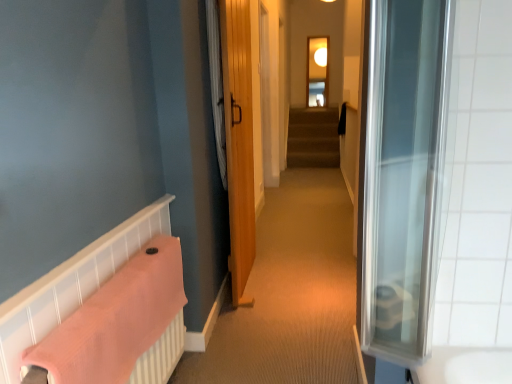
Question: Is pink fabric towel at lower left wider than transparent glass window at upper center?

Choices:
 (A) no
 (B) yes

Answer: (B)

Question: From a real-world perspective, is pink fabric towel at lower left beneath transparent glass window at upper center?

Choices:
 (A) yes
 (B) no

Answer: (A)

Question: Would you consider pink fabric towel at lower left to be distant from transparent glass window at upper center?

Choices:
 (A) yes
 (B) no

Answer: (A)

Question: From the image's perspective, is pink fabric towel at lower left located above transparent glass window at upper center?

Choices:
 (A) yes
 (B) no

Answer: (B)

Question: Is pink fabric towel at lower left placed right next to transparent glass window at upper center?

Choices:
 (A) no
 (B) yes

Answer: (A)

Question: Considering their positions, is pink fabric towel at lower left located in front of or behind transparent glass window at upper center?

Choices:
 (A) behind
 (B) front

Answer: (B)

Question: Based on their positions, is pink fabric towel at lower left located to the left or right of transparent glass window at upper center?

Choices:
 (A) left
 (B) right

Answer: (A)

Question: From a real-world perspective, is pink fabric towel at lower left physically located above or below transparent glass window at upper center?

Choices:
 (A) below
 (B) above

Answer: (A)

Question: Choose the correct answer: Is pink fabric towel at lower left inside transparent glass window at upper center or outside it?

Choices:
 (A) inside
 (B) outside

Answer: (B)

Question: From a real-world perspective, is wooden door at center physically located above or below white fabric shower curtain at center?

Choices:
 (A) above
 (B) below

Answer: (B)

Question: From the image's perspective, is wooden door at center located above or below white fabric shower curtain at center?

Choices:
 (A) above
 (B) below

Answer: (B)

Question: In the image, is wooden door at center on the left side or the right side of white fabric shower curtain at center?

Choices:
 (A) right
 (B) left

Answer: (A)

Question: Considering the positions of wooden door at center and white fabric shower curtain at center in the image, is wooden door at center wider or thinner than white fabric shower curtain at center?

Choices:
 (A) wide
 (B) thin

Answer: (A)

Question: Considering the positions of point (311, 100) and point (114, 321), is point (311, 100) closer or farther from the camera than point (114, 321)?

Choices:
 (A) closer
 (B) farther

Answer: (B)

Question: Is transparent glass window at upper center wider or thinner than pink fabric towel at lower left?

Choices:
 (A) thin
 (B) wide

Answer: (A)